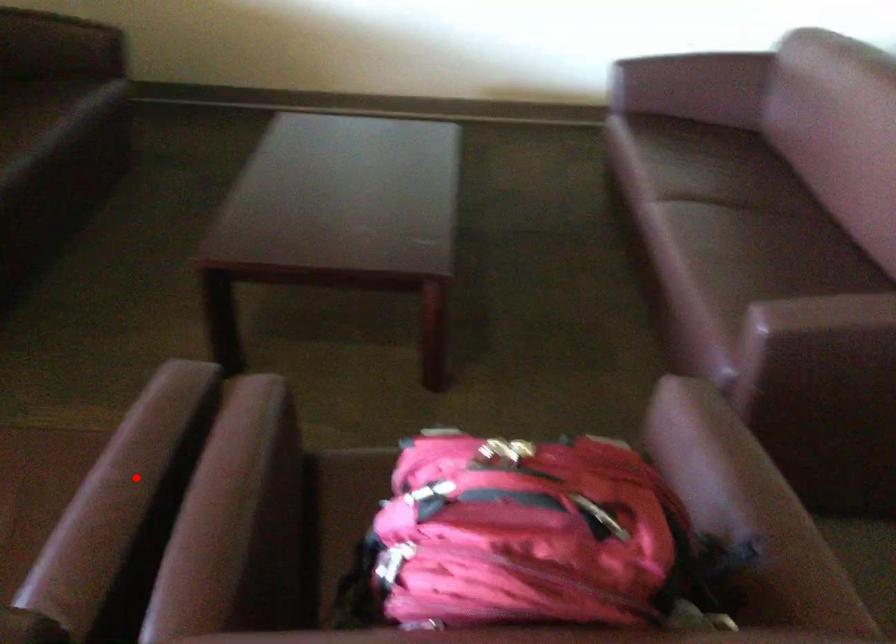
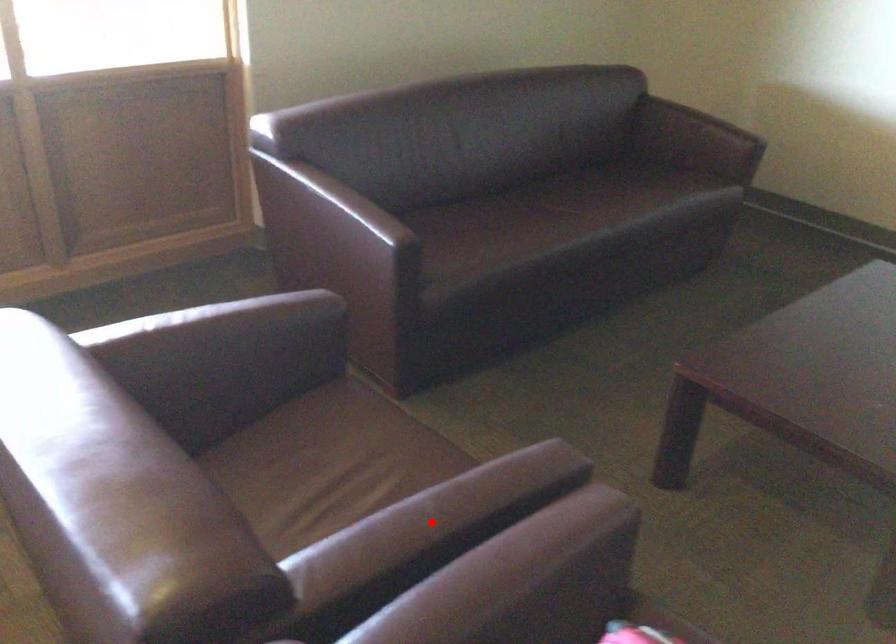
I am providing you with two images of the same scene from different viewpoints. A red point is marked on the first image and another point is marked on the second image. Is the marked point in image1 the same physical position as the marked point in image2?

Yes